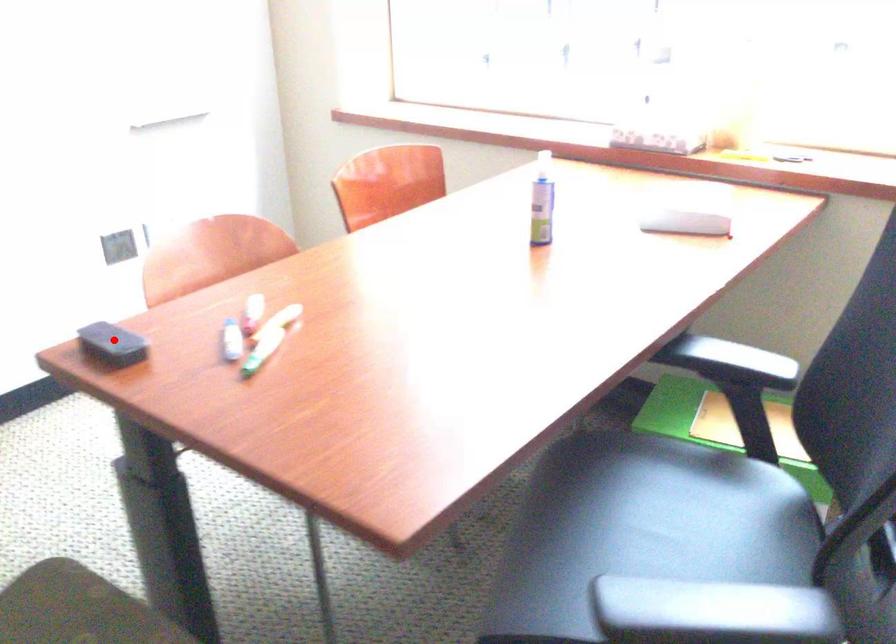
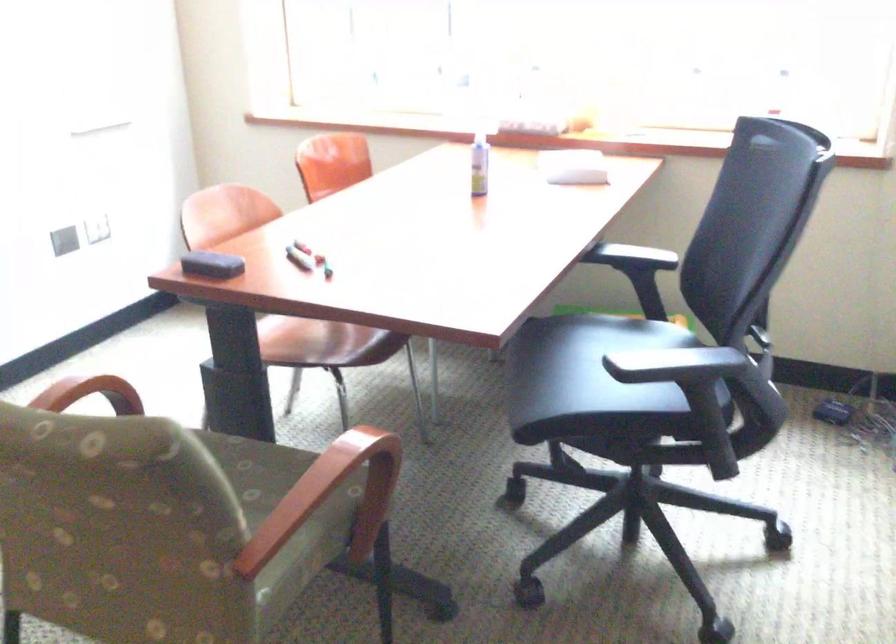
The point at the highlighted location is marked in the first image. Where is the corresponding point in the second image?

(211, 265)